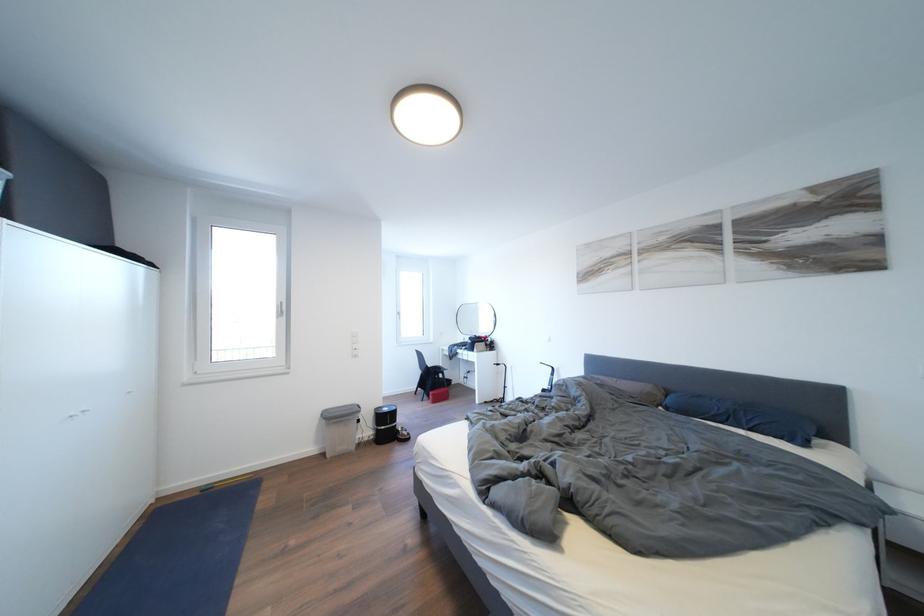
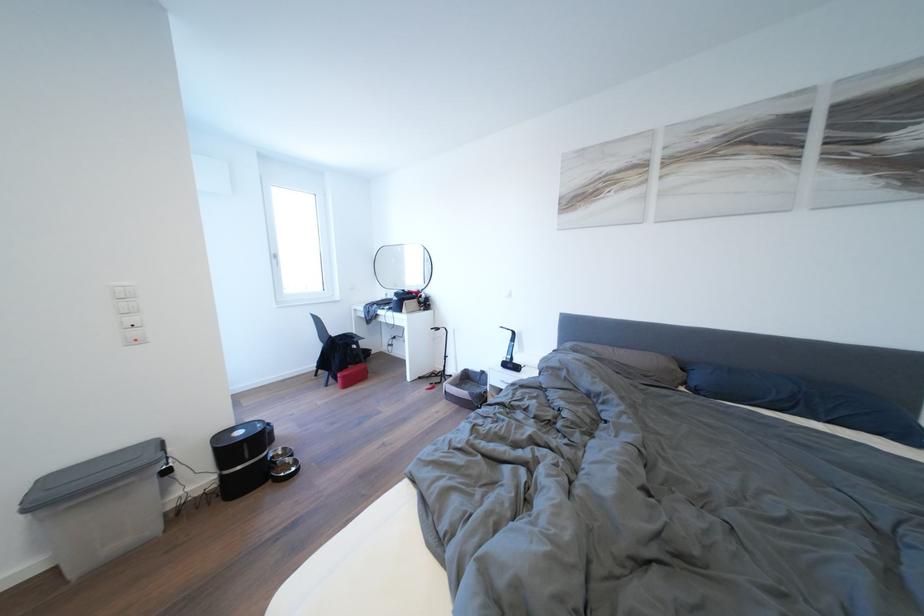
In the second image, find the point that corresponds to (675,413) in the first image.

(703, 395)